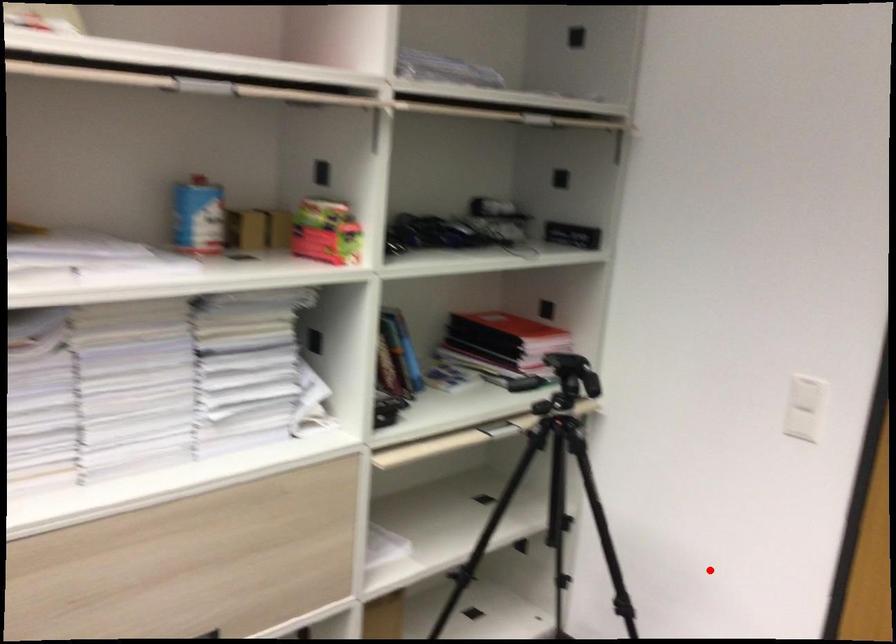
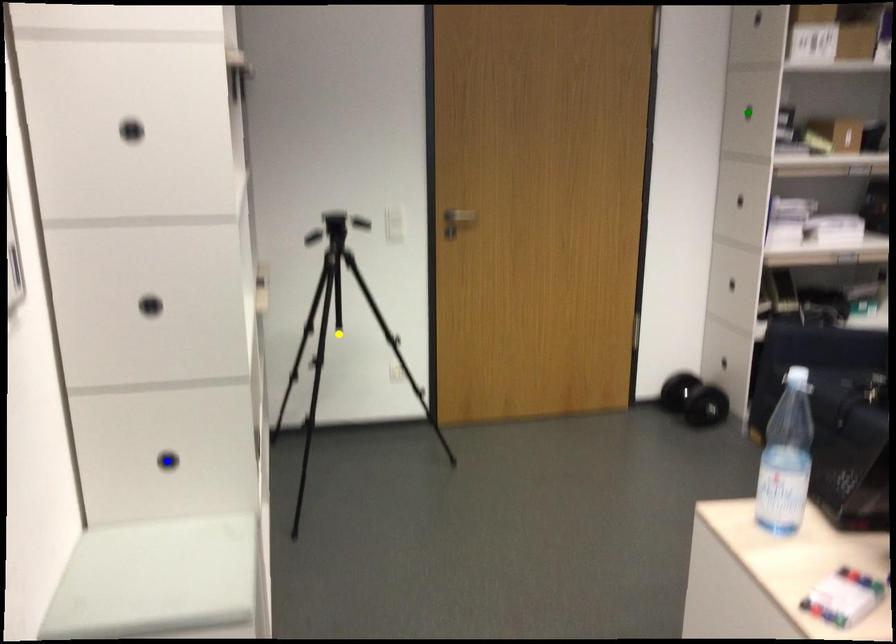
Question: I am providing you with two images of the same scene from different viewpoints. A red point is marked on the first image. You are given multiple points on the second image. Which point in image 2 represents the same 3d spot as the red point in image 1?

Choices:
 (A) green point
 (B) blue point
 (C) yellow point

Answer: (C)